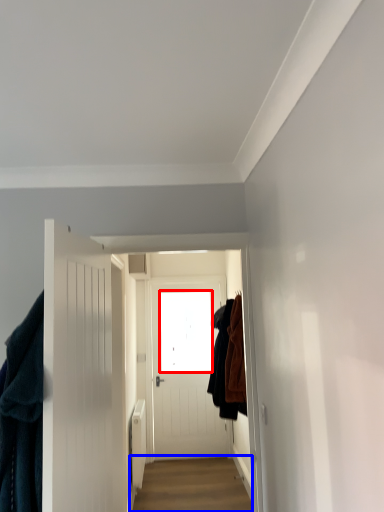
Question: Which point is closer to the camera, window screen (highlighted by a red box) or alley (highlighted by a blue box)?

Choices:
 (A) window screen
 (B) alley

Answer: (B)